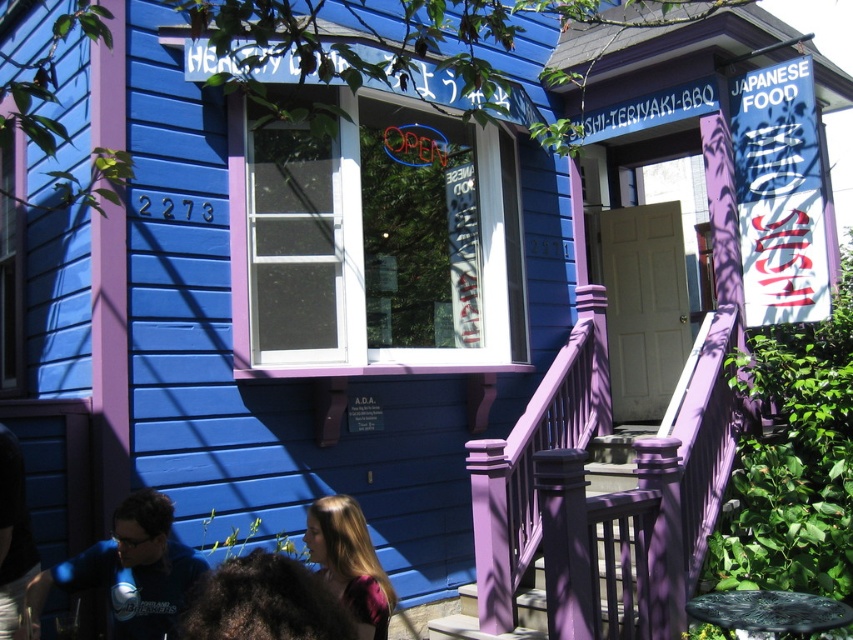
Question: Considering the real-world distances, which object is farthest from the dark curly hair at lower center?

Choices:
 (A) blue fabric shirt at lower left
 (B) dark brown hair at lower left
 (C) blonde hair at lower center

Answer: (B)

Question: Based on their relative distances, which object is nearer to the dark curly hair at lower center?

Choices:
 (A) dark brown hair at lower left
 (B) blue fabric shirt at lower left
 (C) blonde hair at lower center

Answer: (C)

Question: Is blonde hair at lower center in front of dark brown hair at lower left?

Choices:
 (A) yes
 (B) no

Answer: (A)

Question: Which of the following is the closest to the observer?

Choices:
 (A) (358, 531)
 (B) (107, 560)
 (C) (216, 630)

Answer: (C)

Question: Does blue fabric shirt at lower left have a larger size compared to blonde hair at lower center?

Choices:
 (A) yes
 (B) no

Answer: (A)

Question: In this image, where is blue fabric shirt at lower left located relative to blonde hair at lower center?

Choices:
 (A) left
 (B) right

Answer: (A)